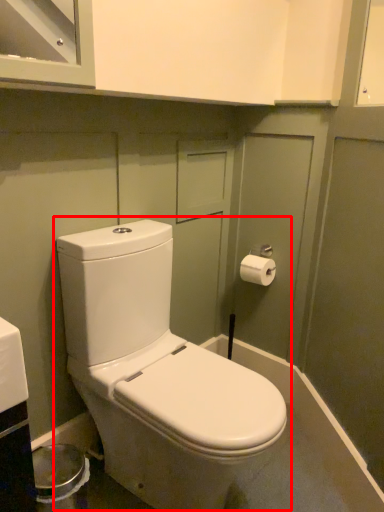
Question: From the image's perspective, considering the relative positions of toilet (annotated by the red box) and toilet paper in the image provided, where is toilet (annotated by the red box) located with respect to the staircase?

Choices:
 (A) above
 (B) below

Answer: (B)